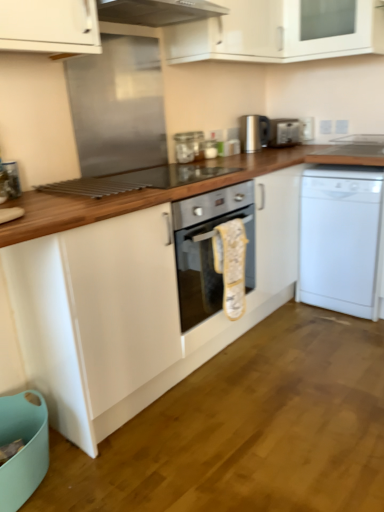
Question: From the image's perspective, is white matte dishwasher at right above or below white glossy cabinet at upper center, the second cabinetry positioned from the right?

Choices:
 (A) below
 (B) above

Answer: (A)

Question: From a real-world perspective, is white matte dishwasher at right positioned above or below white glossy cabinet at upper center, the second cabinetry positioned from the right?

Choices:
 (A) above
 (B) below

Answer: (B)

Question: Considering the real-world distances, which object is closest to the wooden at center?

Choices:
 (A) satin silver kettle at upper center, the first appliance in the left-to-right sequence
 (B) satin silver toaster at upper right, which is counted as the 1th appliance, starting from the right
 (C) white glossy cabinet at upper center, which ranks as the first cabinetry in left-to-right order
 (D) white matte dishwasher at right
 (E) white glossy cabinet at upper center, placed as the 1th cabinetry when sorted from right to left

Answer: (D)

Question: Considering the real-world distances, which object is closest to the satin silver kettle at upper center, the 2th appliance positioned from the right?

Choices:
 (A) wooden at center
 (B) white glossy cabinet at upper center, the second cabinetry positioned from the right
 (C) white glossy cabinet at upper center, which appears as the 2th cabinetry when viewed from the left
 (D) satin silver toaster at upper right, which is counted as the 1th appliance, starting from the right
 (E) white matte dishwasher at right

Answer: (D)